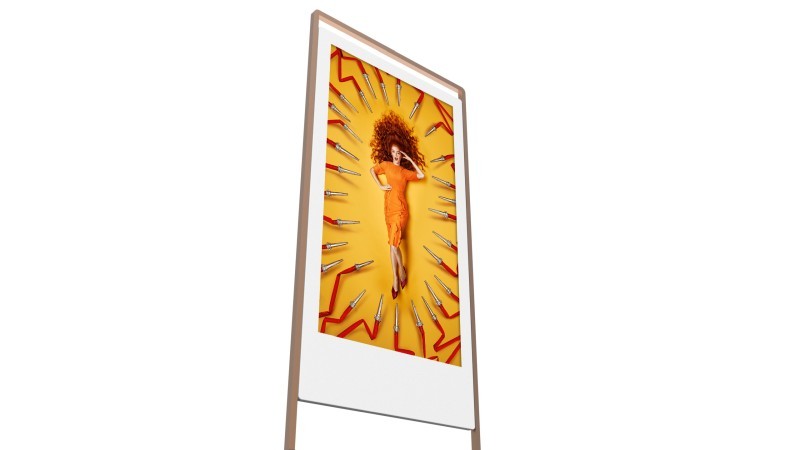
Identify the location of frame. (474, 375), (310, 80), (392, 49).